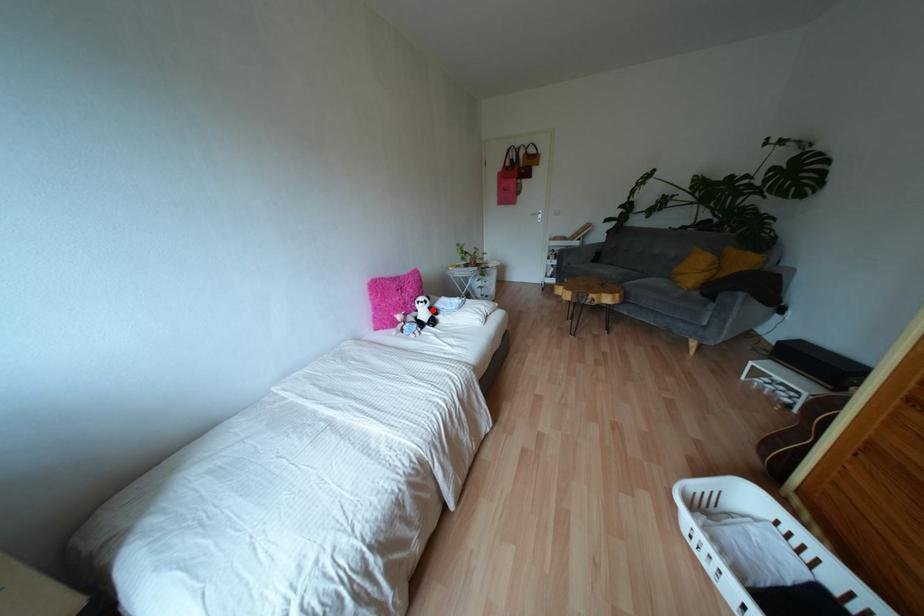
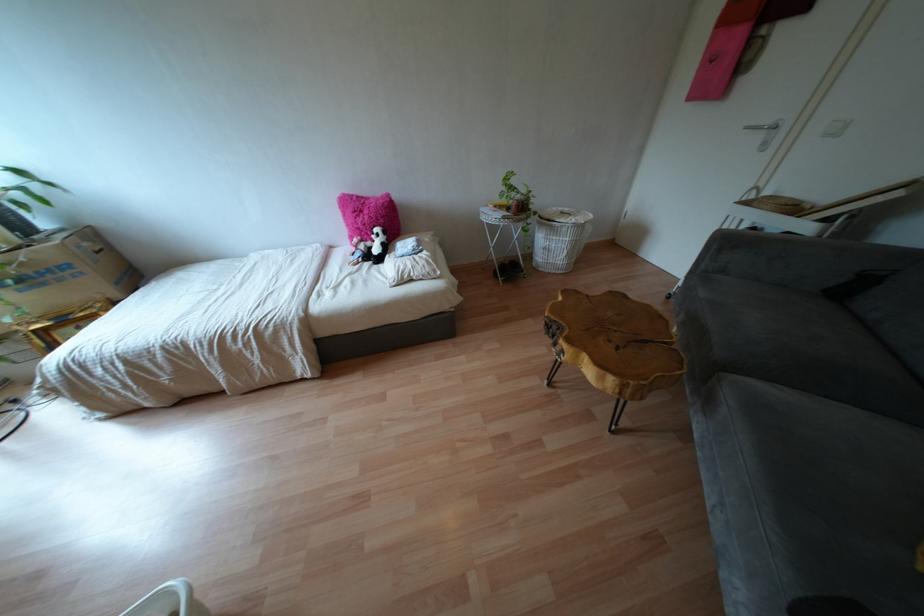
In the second image, find the point that corresponds to the highlighted location in the first image.

(385, 248)